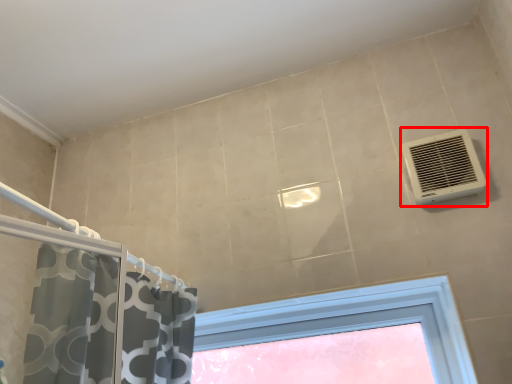
Question: From the image, what is the correct spatial relationship of air conditioning (annotated by the red box) in relation to window?

Choices:
 (A) left
 (B) right

Answer: (B)